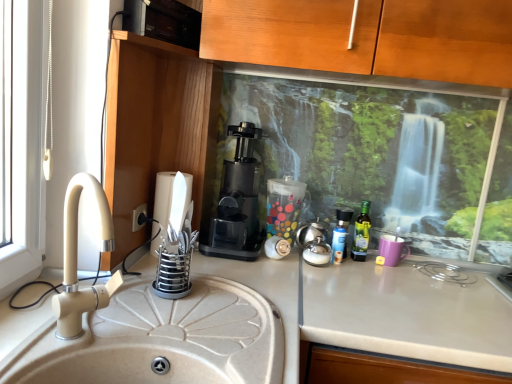
You are a GUI agent. You are given a task and a screenshot of the screen. Output one action in this format:
    pyautogui.click(x=<x>, y=<y>)
    Task: Click on the metallic silver knife block at left
    
    Given the screenshot: What is the action you would take?
    pyautogui.click(x=162, y=204)

Image resolution: width=512 pixels, height=384 pixels. What do you see at coordinates (400, 327) in the screenshot?
I see `white matte countertop at center` at bounding box center [400, 327].

The image size is (512, 384). What are the coordinates of `green glass bottle at right, the first bottle in the right-to-left sequence` in the screenshot? It's located at (361, 233).

At what (x,y) coordinates should I click in order to perform the action: click on metallic silver knife block at left. Please return your answer as a coordinate pair (x, y). Looking at the image, I should click on (162, 204).

Can you tell me how much green glass bottle at right, which is counted as the second bottle, starting from the left, and translucent plastic spray can at center, acting as the second bottle starting from the right, differ in facing direction?

green glass bottle at right, which is counted as the second bottle, starting from the left, and translucent plastic spray can at center, acting as the second bottle starting from the right, are facing 4.83e-05 degrees away from each other.

Considering the relative positions of green glass bottle at right, the first bottle in the right-to-left sequence, and translucent plastic spray can at center, the first bottle in the left-to-right sequence, in the image provided, is green glass bottle at right, the first bottle in the right-to-left sequence, to the right of translucent plastic spray can at center, the first bottle in the left-to-right sequence, from the viewer's perspective?

Indeed, green glass bottle at right, the first bottle in the right-to-left sequence, is positioned on the right side of translucent plastic spray can at center, the first bottle in the left-to-right sequence.

From the image's perspective, between green glass bottle at right, which is counted as the second bottle, starting from the left, and translucent plastic spray can at center, acting as the second bottle starting from the right, who is located below?

green glass bottle at right, which is counted as the second bottle, starting from the left.

Who is taller, green glass bottle at right, which is counted as the second bottle, starting from the left, or translucent plastic spray can at center, the first bottle in the left-to-right sequence?

green glass bottle at right, which is counted as the second bottle, starting from the left.

Considering the sizes of white matte countertop at center and beige ceramic sink at left in the image, is white matte countertop at center bigger or smaller than beige ceramic sink at left?

white matte countertop at center is bigger than beige ceramic sink at left.

From the image's perspective, relative to beige ceramic sink at left, is white matte countertop at center above or below?

white matte countertop at center is below beige ceramic sink at left.

Considering the relative positions of white matte countertop at center and beige ceramic sink at left in the image provided, is white matte countertop at center in front of beige ceramic sink at left?

No, white matte countertop at center is behind beige ceramic sink at left.

Is beige ceramic sink at left at the back of white matte countertop at center?

No, white matte countertop at center is not facing away from beige ceramic sink at left.

Can you confirm if metallic silver knife block at left is positioned to the right of black plastic coffee machine at center?

No, metallic silver knife block at left is not to the right of black plastic coffee machine at center.

Does point (168, 190) lie behind point (240, 148)?

No, (168, 190) is in front of (240, 148).

From the image's perspective, would you say metallic silver knife block at left is shown under black plastic coffee machine at center?

Correct, metallic silver knife block at left appears lower than black plastic coffee machine at center in the image.

How much distance is there between metallic silver knife block at left and black plastic coffee machine at center?

The distance of metallic silver knife block at left from black plastic coffee machine at center is 7.96 inches.

Does black plastic electric outlet at lower left contain beige ceramic sink at left?

No, beige ceramic sink at left is not inside black plastic electric outlet at lower left.

Does black plastic electric outlet at lower left touch beige ceramic sink at left?

black plastic electric outlet at lower left and beige ceramic sink at left are clearly separated.

Between black plastic electric outlet at lower left and beige ceramic sink at left, which one is positioned in front?

beige ceramic sink at left is more forward.

From a real-world perspective, is black plastic electric outlet at lower left physically located above or below beige ceramic sink at left?

black plastic electric outlet at lower left is below beige ceramic sink at left.

Is translucent plastic spray can at center, the first bottle in the left-to-right sequence, facing towards black plastic coffee machine at center?

No, translucent plastic spray can at center, the first bottle in the left-to-right sequence, is not turned towards black plastic coffee machine at center.

Where is `the 1st bottle to the right when counting from the black plastic coffee machine at center`? The height and width of the screenshot is (384, 512). the 1st bottle to the right when counting from the black plastic coffee machine at center is located at coordinates (342, 228).

From a real-world perspective, between translucent plastic spray can at center, the first bottle in the left-to-right sequence, and black plastic coffee machine at center, who is vertically higher?

black plastic coffee machine at center is physically above.

Does green glass bottle at right, the first bottle in the right-to-left sequence, appear on the right side of beige ceramic sink at left?

Correct, you'll find green glass bottle at right, the first bottle in the right-to-left sequence, to the right of beige ceramic sink at left.

You are a GUI agent. You are given a task and a screenshot of the screen. Output one action in this format:
    pyautogui.click(x=<x>, y=<y>)
    Task: Click on the sink above the green glass bottle at right, the first bottle in the right-to-left sequence (from the image's perspective)
    The image size is (512, 384).
    Given the screenshot: What is the action you would take?
    pyautogui.click(x=147, y=327)

From the image's perspective, is green glass bottle at right, the first bottle in the right-to-left sequence, located above or below beige ceramic sink at left?

Clearly, from the image's perspective, green glass bottle at right, the first bottle in the right-to-left sequence, is below beige ceramic sink at left.

Based on the photo, is green glass bottle at right, the first bottle in the right-to-left sequence, looking in the opposite direction of beige ceramic sink at left?

No, green glass bottle at right, the first bottle in the right-to-left sequence, is not facing the opposite direction of beige ceramic sink at left.

Considering the positions of points (476, 371) and (135, 217), is point (476, 371) farther from camera compared to point (135, 217)?

No, (476, 371) is in front of (135, 217).

Consider the image. Would you say black plastic electric outlet at lower left is part of white matte countertop at center's contents?

No.

Based on the photo, from the image's perspective, between white matte countertop at center and black plastic electric outlet at lower left, which one is located above?

black plastic electric outlet at lower left is shown above in the image.

Considering the sizes of white matte countertop at center and black plastic electric outlet at lower left in the image, is white matte countertop at center wider or thinner than black plastic electric outlet at lower left?

Considering their sizes, white matte countertop at center looks broader than black plastic electric outlet at lower left.

Locate an element on the screen. This screenshot has height=384, width=512. bottle that appears below the translucent plastic spray can at center, the first bottle in the left-to-right sequence (from the image's perspective) is located at coordinates (361, 233).

This screenshot has width=512, height=384. There is a white matte countertop at center. Identify the location of sink above it (from a real-world perspective). (147, 327).

From the picture: When comparing their distances from metallic silver knife block at left, does white matte countertop at center or translucent plastic spray can at center, the first bottle in the left-to-right sequence, seem further?

Among the two, white matte countertop at center is located further to metallic silver knife block at left.

Based on their spatial positions, is white matte countertop at center or green glass bottle at right, the first bottle in the right-to-left sequence, further from black plastic coffee machine at center?

Based on the image, white matte countertop at center appears to be further to black plastic coffee machine at center.

When comparing their distances from black plastic coffee machine at center, does translucent plastic spray can at center, acting as the second bottle starting from the right, or green glass bottle at right, the first bottle in the right-to-left sequence, seem closer?

translucent plastic spray can at center, acting as the second bottle starting from the right, is positioned closer to the anchor black plastic coffee machine at center.

Which object lies nearer to the anchor point beige ceramic sink at left, black plastic coffee machine at center or black plastic electric outlet at lower left?

The object closer to beige ceramic sink at left is black plastic coffee machine at center.

From the image, which object appears to be farther from beige ceramic sink at left, metallic silver knife block at left or black plastic electric outlet at lower left?

black plastic electric outlet at lower left is further to beige ceramic sink at left.

In the scene shown: Considering their positions, is beige ceramic sink at left positioned further to green glass bottle at right, the first bottle in the right-to-left sequence, than black plastic electric outlet at lower left?

Based on the image, beige ceramic sink at left appears to be further to green glass bottle at right, the first bottle in the right-to-left sequence.

From the picture: When comparing their distances from black plastic coffee machine at center, does metallic silver knife block at left or green glass bottle at right, which is counted as the second bottle, starting from the left, seem further?

green glass bottle at right, which is counted as the second bottle, starting from the left, is positioned further to the anchor black plastic coffee machine at center.

From the image, which object appears to be nearer to black plastic coffee machine at center, beige ceramic sink at left or white matte countertop at center?

beige ceramic sink at left lies closer to black plastic coffee machine at center than the other object.

Locate an element on the screen. Image resolution: width=512 pixels, height=384 pixels. coffee machine between beige ceramic sink at left and green glass bottle at right, the first bottle in the right-to-left sequence, along the z-axis is located at coordinates (237, 202).

Image resolution: width=512 pixels, height=384 pixels. Identify the location of electric outlet between beige ceramic sink at left and green glass bottle at right, which is counted as the second bottle, starting from the left, from front to back. (138, 217).

Where is `appliance between beige ceramic sink at left and translucent plastic spray can at center, acting as the second bottle starting from the right, along the z-axis`? appliance between beige ceramic sink at left and translucent plastic spray can at center, acting as the second bottle starting from the right, along the z-axis is located at coordinates (162, 204).

At what (x,y) coordinates should I click in order to perform the action: click on sink between black plastic electric outlet at lower left and white matte countertop at center in the horizontal direction. Please return your answer as a coordinate pair (x, y). This screenshot has height=384, width=512. Looking at the image, I should click on (147, 327).